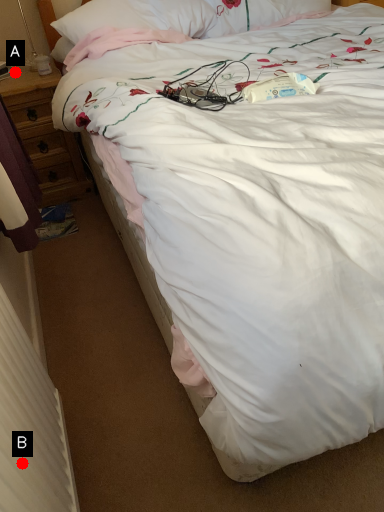
Question: Two points are circled on the image, labeled by A and B beside each circle. Which point appears closest to the camera in this image?

Choices:
 (A) A is closer
 (B) B is closer

Answer: (B)